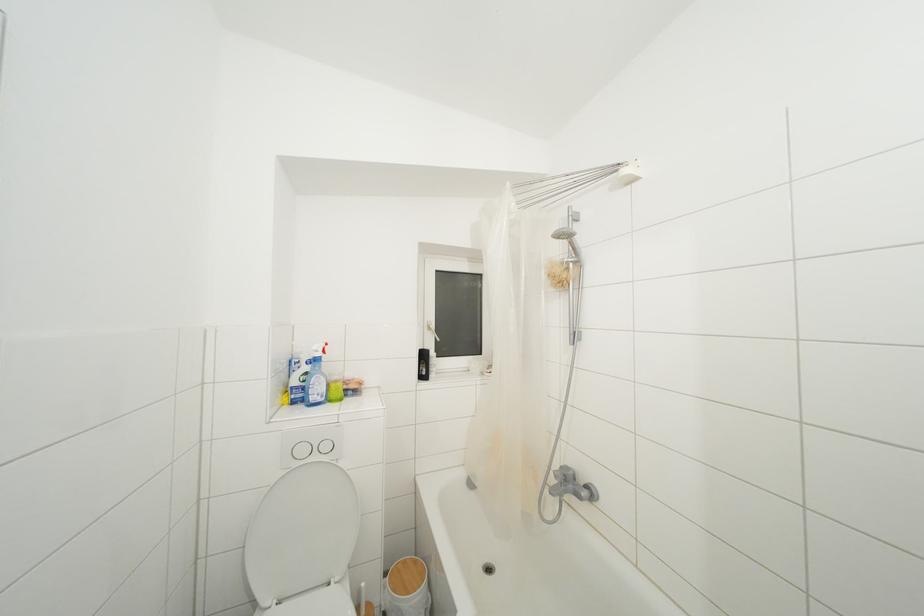
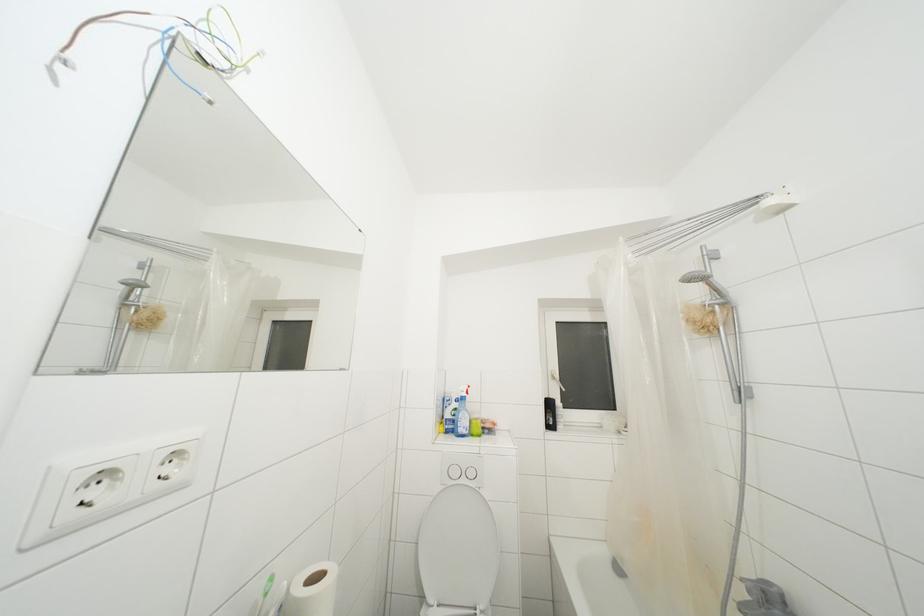
Question: Which direction would the cameraman need to move to produce the second image? Reply with the corresponding letter.

Choices:
 (A) Left
 (B) Right
 (C) Forward
 (D) Backward

Answer: (D)